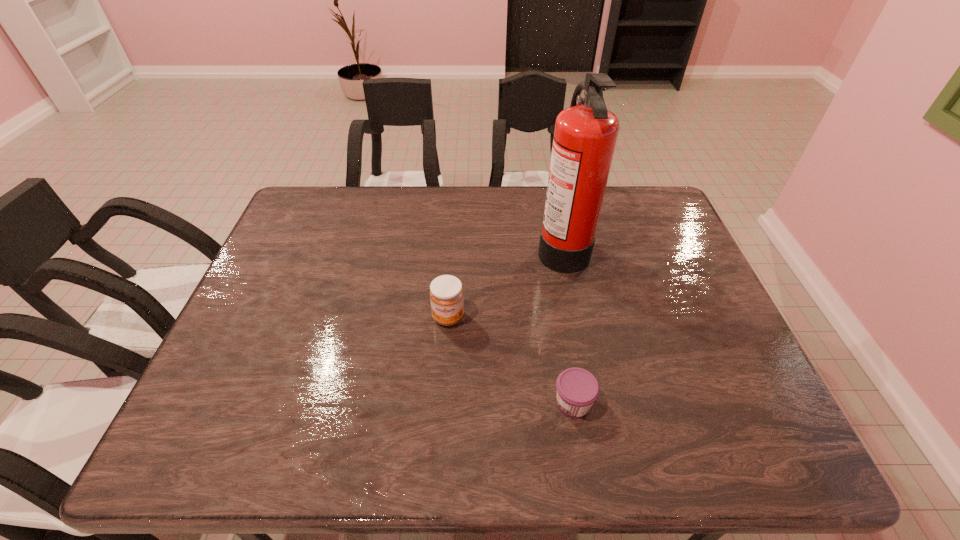
Find the location of a particular element. the farthest object is located at coordinates (585, 135).

Locate an element on the screen. The width and height of the screenshot is (960, 540). fire extinguisher is located at coordinates (585, 135).

At what (x,y) coordinates should I click in order to perform the action: click on the leftmost object. Please return your answer as a coordinate pair (x, y). This screenshot has height=540, width=960. Looking at the image, I should click on (446, 293).

Locate an element on the screen. This screenshot has height=540, width=960. the second tallest object is located at coordinates [x=446, y=293].

The image size is (960, 540). What are the coordinates of `the nearest object` in the screenshot? It's located at (577, 389).

You are a GUI agent. You are given a task and a screenshot of the screen. Output one action in this format:
    pyautogui.click(x=<x>, y=<y>)
    Task: Click on the shorter jam
    
    Given the screenshot: What is the action you would take?
    pyautogui.click(x=577, y=389)

Where is `vacant space located 0.190m on the front-facing side of the tallest object`? Image resolution: width=960 pixels, height=540 pixels. vacant space located 0.190m on the front-facing side of the tallest object is located at coordinates (473, 247).

Identify the location of free point located on the front-facing side of the tallest object. Image resolution: width=960 pixels, height=540 pixels. (422, 247).

Locate an element on the screen. vacant space situated on the front-facing side of the tallest object is located at coordinates (409, 247).

Where is `free region located 0.230m on the front label of the taller jam`? free region located 0.230m on the front label of the taller jam is located at coordinates (442, 416).